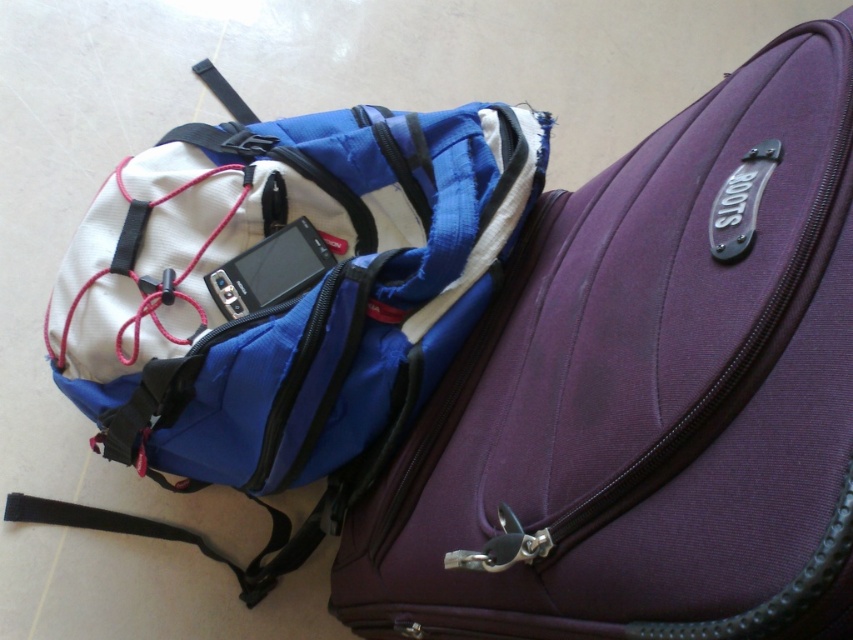
You are packing for a trip and need to decide which item to place in your bag first. Given the sizes of the purple fabric suitcase at center and the satin black smartphone at center, which one should you put into your bag first and why?

The satin black smartphone at center should be placed into the bag first because the purple fabric suitcase at center is larger in size, making it easier to store the smaller item first to optimize space.

You are standing 20 inches away from the purple fabric suitcase at center. Can you reach it without moving your feet?

The purple fabric suitcase at center is 17.19 inches away from the viewer. Since you are standing 20 inches away, it is slightly farther than your reach. You might need to take a small step forward to reach it.

You are packing for a trip and need to place your satin black smartphone at center into the purple fabric suitcase at center. The smartphone is 5.5 inches long. Can the smartphone fit into the suitcase?

The distance between the purple fabric suitcase at center and the satin black smartphone at center is 17.03 inches. However, this distance does not indicate the size of the suitcase. Therefore, it is unclear if the smartphone will fit.